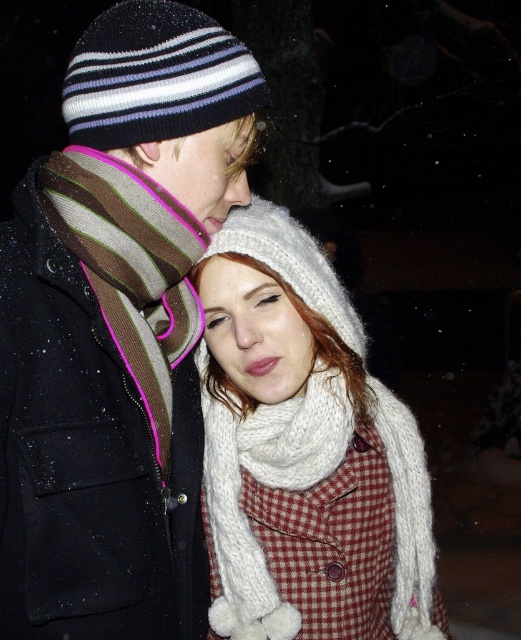
Who is positioned more to the left, white knitted hat at center or striped knit scarf at left?

From the viewer's perspective, striped knit scarf at left appears more on the left side.

Image resolution: width=521 pixels, height=640 pixels. Find the location of `white knitted hat at center`. white knitted hat at center is located at coordinates (304, 451).